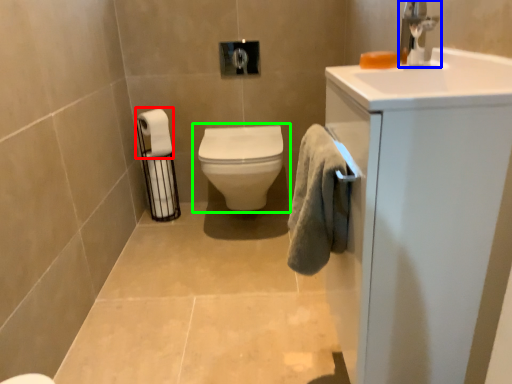
Question: Which is farther away from toilet paper (highlighted by a red box)? tap (highlighted by a blue box) or toilet (highlighted by a green box)?

Choices:
 (A) tap
 (B) toilet

Answer: (A)